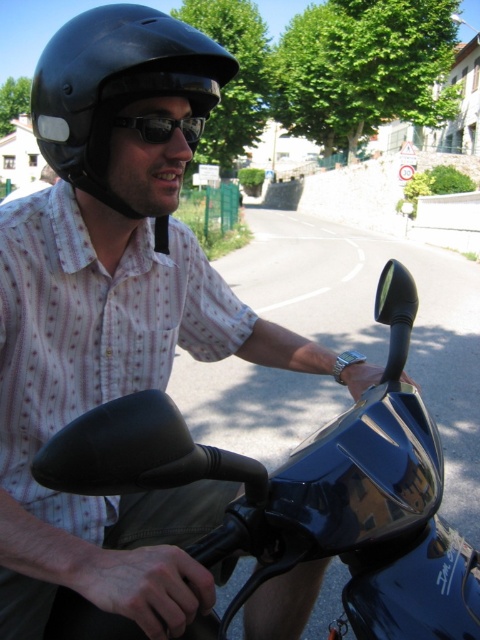
Question: Estimate the real-world distances between objects in this image. Which object is farther from the black matte helmet at upper left?

Choices:
 (A) black reflective sunglasses at center
 (B) white dotted shirt at center

Answer: (B)

Question: Which point is farther to the camera?

Choices:
 (A) (142, 132)
 (B) (38, 388)
 (C) (97, 83)

Answer: (B)

Question: Does white dotted shirt at center have a larger size compared to black matte helmet at upper left?

Choices:
 (A) no
 (B) yes

Answer: (A)

Question: Which of these objects is positioned farthest from the white dotted shirt at center?

Choices:
 (A) black matte helmet at upper left
 (B) black reflective sunglasses at center

Answer: (B)

Question: Can you confirm if black matte helmet at upper left is positioned to the left of black reflective sunglasses at center?

Choices:
 (A) no
 (B) yes

Answer: (B)

Question: In this image, where is white dotted shirt at center located relative to black reflective sunglasses at center?

Choices:
 (A) right
 (B) left

Answer: (B)